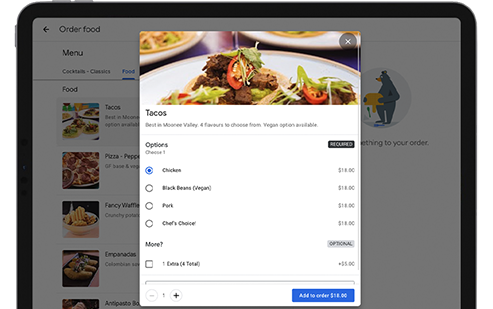
Where is `dining table`? The height and width of the screenshot is (309, 493). dining table is located at coordinates (227, 43).